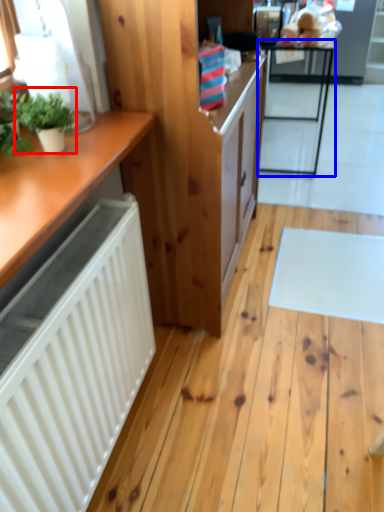
Question: Which of the following is the farthest to the observer, houseplant (highlighted by a red box) or table (highlighted by a blue box)?

Choices:
 (A) houseplant
 (B) table

Answer: (B)